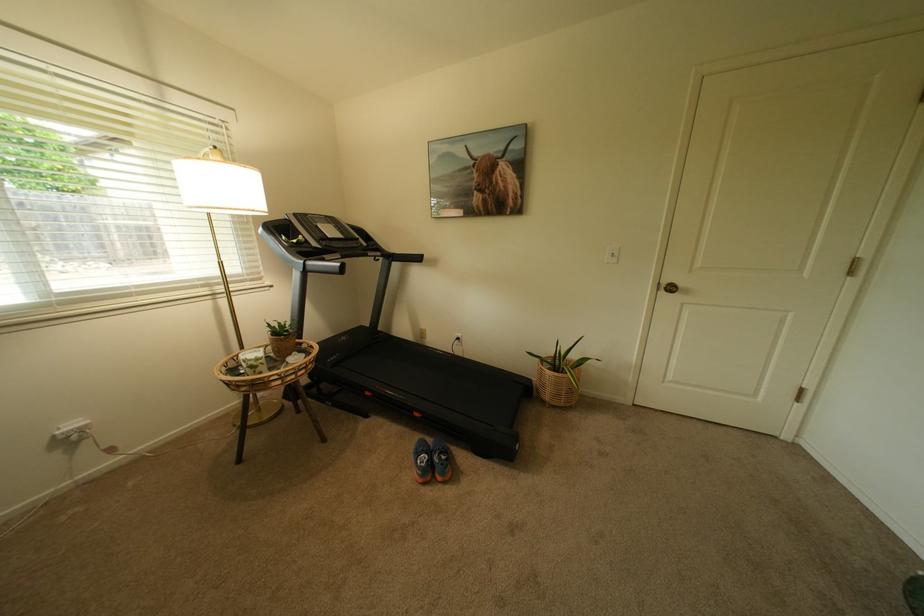
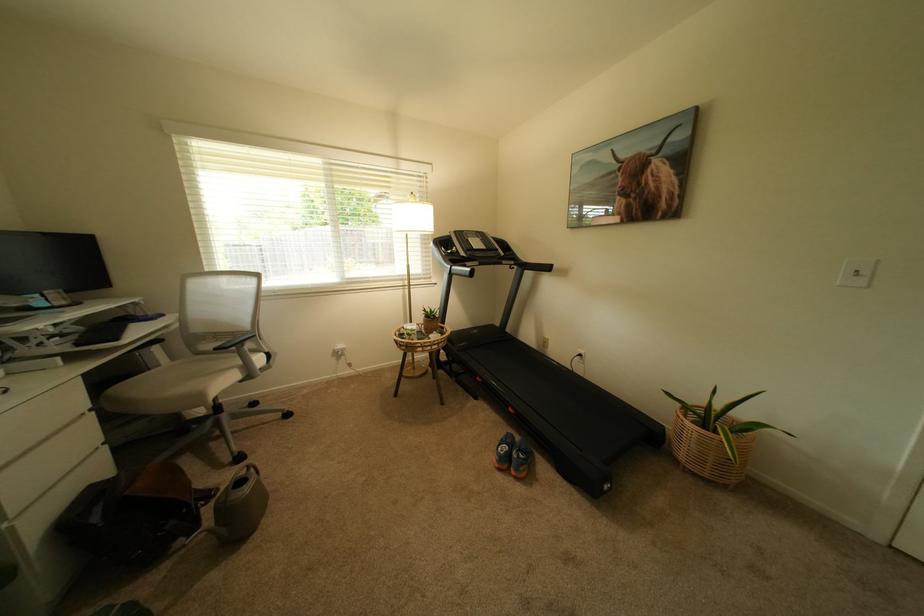
Locate, in the second image, the point that corresponds to point 435,456 in the first image.

(517, 448)